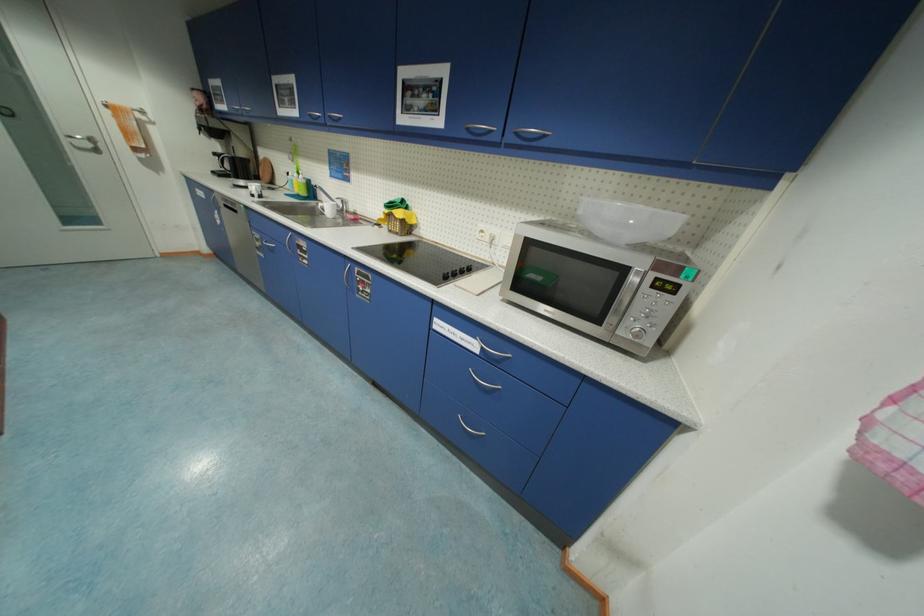
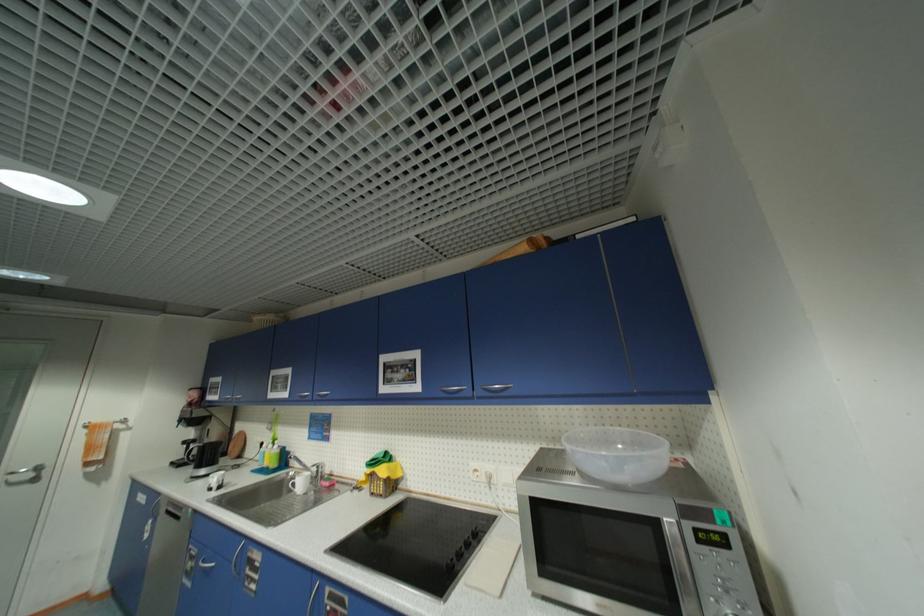
In the second image, find the point that corresponds to (x=393, y=213) in the first image.

(374, 472)